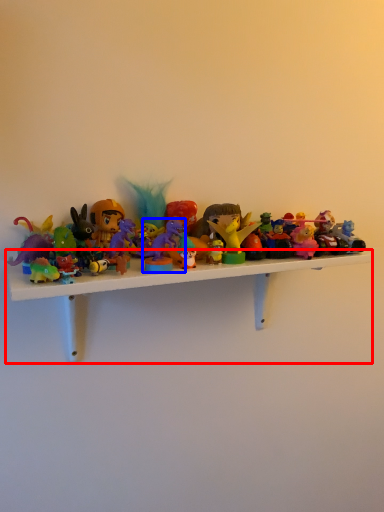
Question: Which point is closer to the camera, shelf (highlighted by a red box) or toy (highlighted by a blue box)?

Choices:
 (A) shelf
 (B) toy

Answer: (A)